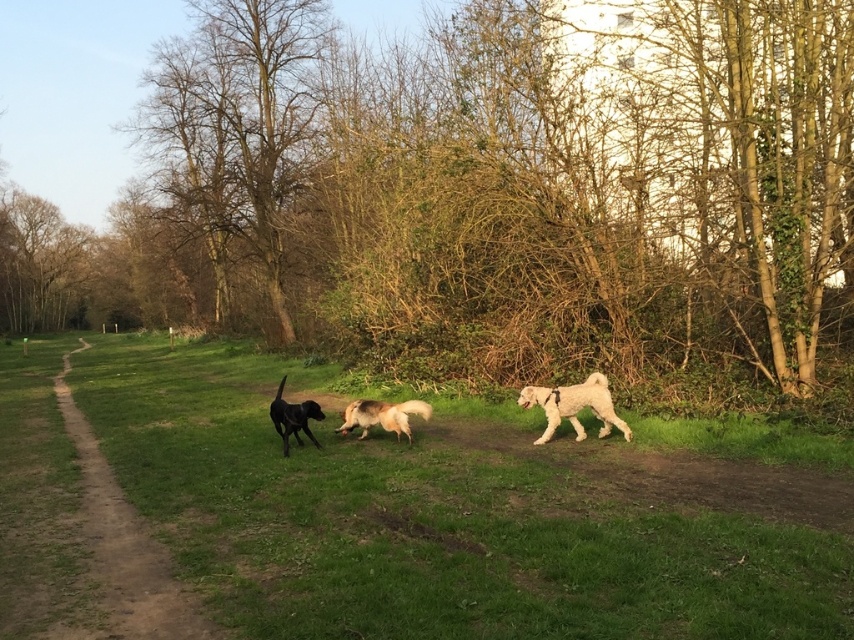
Question: Which point appears farthest from the camera in this image?

Choices:
 (A) (296, 404)
 (B) (422, 417)
 (C) (45, 230)

Answer: (C)

Question: Which point appears farthest from the camera in this image?

Choices:
 (A) (554, 424)
 (B) (284, 440)

Answer: (A)

Question: Does green grass at center have a lesser width compared to white fluffy dog at center?

Choices:
 (A) yes
 (B) no

Answer: (B)

Question: Estimate the real-world distances between objects in this image. Which object is closer to the bare wood tree at upper center?

Choices:
 (A) shiny black dog at center
 (B) dirt path at left
 (C) white fluffy dog at center
 (D) brown leafless tree at center

Answer: (D)

Question: Does brown leafless tree at center have a greater width compared to shiny black dog at center?

Choices:
 (A) no
 (B) yes

Answer: (B)

Question: Does dirt path at left lie in front of white fluffy dog at center?

Choices:
 (A) no
 (B) yes

Answer: (B)